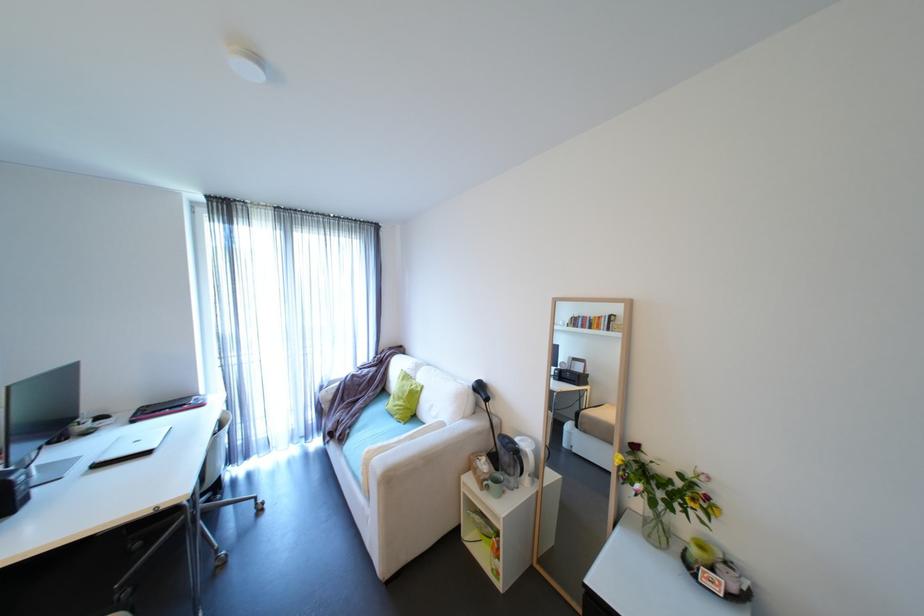
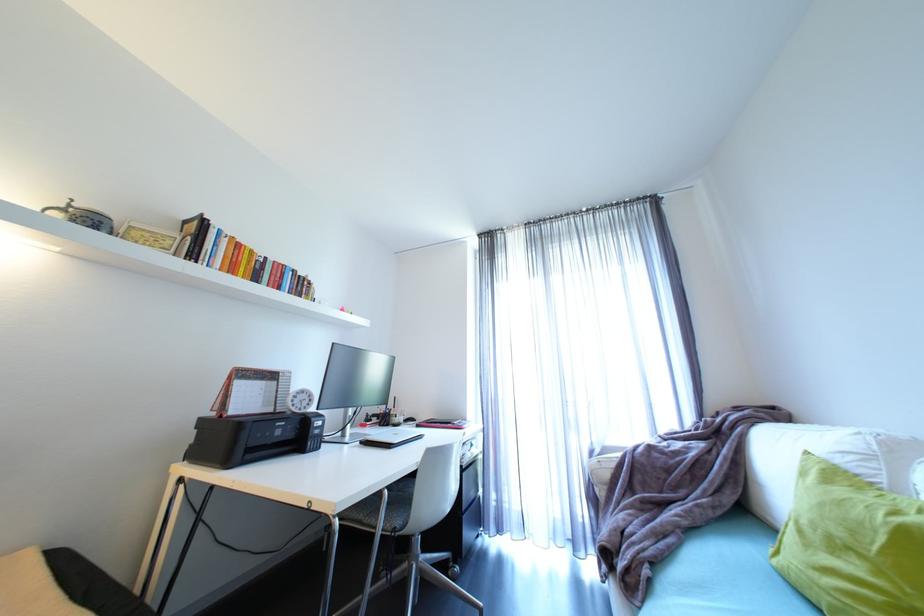
Find the pixel in the second image that matches the point at 411,402 in the first image.

(885, 573)